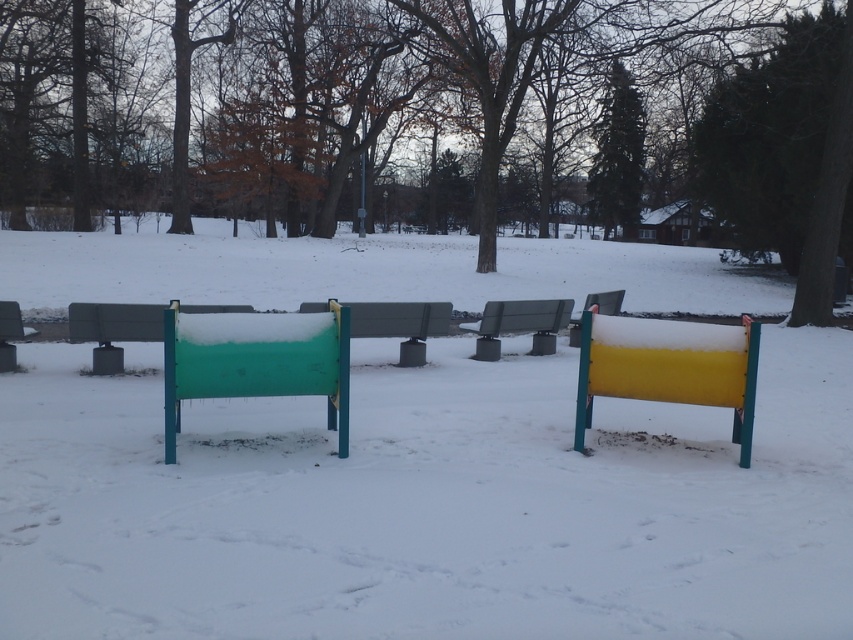
Question: Is green painted wood sign at center to the right of matte black bench at left from the viewer's perspective?

Choices:
 (A) no
 (B) yes

Answer: (B)

Question: In this image, where is green painted wood sign at center located relative to metallic gray bench at center?

Choices:
 (A) below
 (B) above

Answer: (B)

Question: Considering the real-world distances, which object is farthest from the gray plastic bench at center?

Choices:
 (A) metallic gray bench at center
 (B) green painted wood sign at center
 (C) green painted wood at upper center
 (D) yellow matte bench at right

Answer: (C)

Question: Can you confirm if green painted wood at upper right is smaller than gray plastic bench at center?

Choices:
 (A) no
 (B) yes

Answer: (A)

Question: Which object appears closest to the camera in this image?

Choices:
 (A) green painted wood bench at center
 (B) yellow matte bench at right

Answer: (A)

Question: Which point is farther to the camera?

Choices:
 (A) (732, 396)
 (B) (781, 204)
 (C) (440, 310)

Answer: (B)